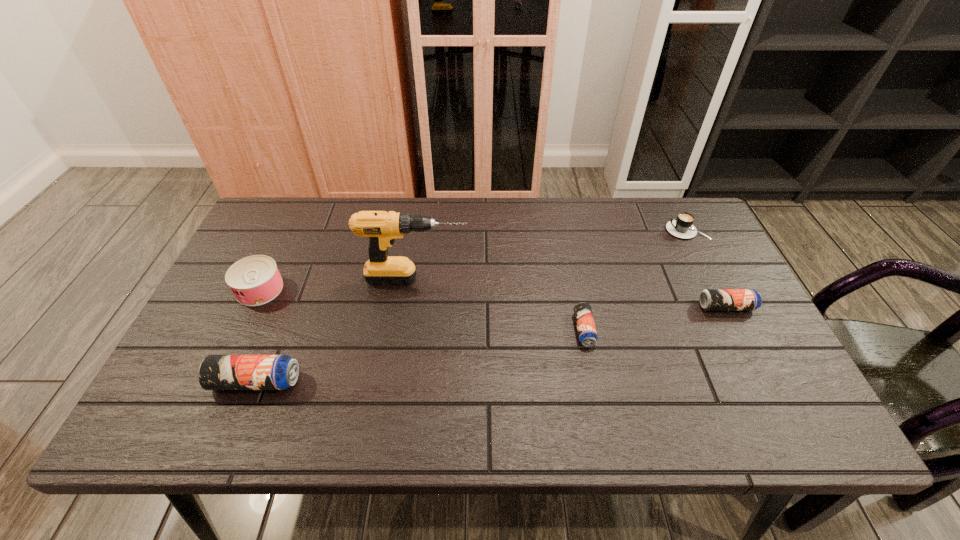
To achieve even spacing by inserting another beer_can among them, please point to a vacant spot for this new beer_can. Please provide its 2D coordinates. Your answer should be formatted as a tuple, i.e. [(x, y)], where the tuple contains the x and y coordinates of a point satisfying the conditions above.

[(428, 354)]